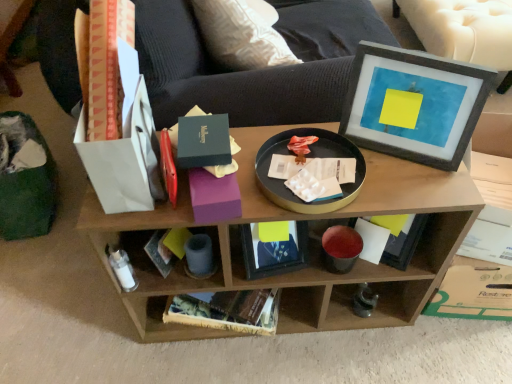
The width and height of the screenshot is (512, 384). Describe the element at coordinates (308, 157) in the screenshot. I see `black matte tray at center` at that location.

This screenshot has width=512, height=384. Find the location of `wooden shelf at center`. wooden shelf at center is located at coordinates (310, 249).

Describe the element at coordinates (404, 243) in the screenshot. Image resolution: width=512 pixels, height=384 pixels. I see `white paper book at lower center` at that location.

What do you see at coordinates (413, 104) in the screenshot? The width and height of the screenshot is (512, 384). I see `matte gray picture frame at upper right` at bounding box center [413, 104].

This screenshot has height=384, width=512. Identify the location of black matte tray at center. pyautogui.click(x=308, y=157).

Based on the photo, is wooden shelf at center looking in the opposite direction of white paper book at lower center?

That's right, wooden shelf at center is facing away from white paper book at lower center.

How many degrees apart are the facing directions of wooden shelf at center and white paper book at lower center?

6.3 degrees.

From a real-world perspective, is wooden shelf at center below white paper book at lower center?

Yes, from a real-world perspective, wooden shelf at center is under white paper book at lower center.

Based on their sizes in the image, would you say wooden shelf at center is bigger or smaller than black matte tray at center?

In the image, wooden shelf at center appears to be larger than black matte tray at center.

Which is behind, wooden shelf at center or black matte tray at center?

wooden shelf at center is further away from the camera.

Which of these two, wooden shelf at center or black matte tray at center, stands shorter?

black matte tray at center.

Is wooden shelf at center turned away from black matte tray at center?

No, black matte tray at center is not at the back of wooden shelf at center.

Is white paper book at lower center turned away from wooden shelf at center?

Yes, white paper book at lower center is facing away from wooden shelf at center.

Which point is more forward, [408,233] or [456,245]?

Point [456,245]

Which is behind, white paper book at lower center or wooden shelf at center?

white paper book at lower center is further away from the camera.

Is matte gray picture frame at upper right not close to white paper book at lower center?

matte gray picture frame at upper right is actually quite close to white paper book at lower center.

Would you say matte gray picture frame at upper right is outside white paper book at lower center?

Yes.

From a real-world perspective, is matte gray picture frame at upper right physically below white paper book at lower center?

No, from a real-world perspective, matte gray picture frame at upper right is not beneath white paper book at lower center.

How different are the orientations of matte gray picture frame at upper right and white paper book at lower center in degrees?

There is a 25-degree angle between the facing directions of matte gray picture frame at upper right and white paper book at lower center.

Is black matte tray at center spatially inside white paper book at lower center, or outside of it?

black matte tray at center lies outside white paper book at lower center.

Is black matte tray at center wider or thinner than white paper book at lower center?

Clearly, black matte tray at center has more width compared to white paper book at lower center.

From the image's perspective, is black matte tray at center positioned above or below white paper book at lower center?

Clearly, from the image's perspective, black matte tray at center is above white paper book at lower center.

Is black matte tray at center taller than white paper book at lower center?

Incorrect, the height of black matte tray at center is not larger of that of white paper book at lower center.

Can you confirm if matte gray picture frame at upper right is smaller than black matte tray at center?

No.

From a real-world perspective, is matte gray picture frame at upper right on top of black matte tray at center?

Yes.

From the image's perspective, is matte gray picture frame at upper right located above black matte tray at center?

Yes.

Considering the positions of point (425, 60) and point (264, 153), is point (425, 60) closer or farther from the camera than point (264, 153)?

Point (425, 60) is closer to the camera than point (264, 153).

From a real-world perspective, is white paper book at lower center above or below black matte tray at center?

In terms of real-world spatial position, white paper book at lower center is below black matte tray at center.

Is white paper book at lower center far away from black matte tray at center?

No.

Is white paper book at lower center completely or partially outside of black matte tray at center?

That's correct, white paper book at lower center is outside of black matte tray at center.

Consider the image. Between white paper book at lower center and black matte tray at center, which one has more height?

Standing taller between the two is white paper book at lower center.

This screenshot has height=384, width=512. I want to click on book that is below the wooden shelf at center (from the image's perspective), so click(x=404, y=243).

This screenshot has width=512, height=384. What are the coordinates of `shelf below the black matte tray at center (from a real-world perspective)` in the screenshot? It's located at (310, 249).

Considering their positions, is white paper book at lower center positioned further to matte gray picture frame at upper right than wooden shelf at center?

The object further to matte gray picture frame at upper right is white paper book at lower center.

Considering their positions, is matte gray picture frame at upper right positioned further to wooden shelf at center than white paper book at lower center?

white paper book at lower center.

Looking at this image, estimate the real-world distances between objects in this image. Which object is further from matte gray picture frame at upper right, wooden shelf at center or white paper book at lower center?

white paper book at lower center is positioned further to the anchor matte gray picture frame at upper right.

Which object lies nearer to the anchor point black matte tray at center, white paper book at lower center or wooden shelf at center?

Among the two, wooden shelf at center is located nearer to black matte tray at center.

Which object lies nearer to the anchor point black matte tray at center, wooden shelf at center or white paper book at lower center?

Among the two, wooden shelf at center is located nearer to black matte tray at center.

Looking at this image, which object lies nearer to the anchor point black matte tray at center, white paper book at lower center or matte gray picture frame at upper right?

matte gray picture frame at upper right lies closer to black matte tray at center than the other object.

Considering their positions, is black matte tray at center positioned closer to wooden shelf at center than white paper book at lower center?

Based on the image, black matte tray at center appears to be nearer to wooden shelf at center.

Estimate the real-world distances between objects in this image. Which object is further from matte gray picture frame at upper right, black matte tray at center or wooden shelf at center?

Among the two, wooden shelf at center is located further to matte gray picture frame at upper right.

Locate an element on the screen. Image resolution: width=512 pixels, height=384 pixels. round table between wooden shelf at center and white paper book at lower center from left to right is located at coordinates (308, 157).

The height and width of the screenshot is (384, 512). Find the location of `shelf between matte gray picture frame at upper right and white paper book at lower center in the vertical direction`. shelf between matte gray picture frame at upper right and white paper book at lower center in the vertical direction is located at coordinates (310, 249).

Locate an element on the screen. The width and height of the screenshot is (512, 384). round table between matte gray picture frame at upper right and white paper book at lower center in the up-down direction is located at coordinates (308, 157).

Locate an element on the screen. The image size is (512, 384). round table between matte gray picture frame at upper right and wooden shelf at center vertically is located at coordinates (308, 157).